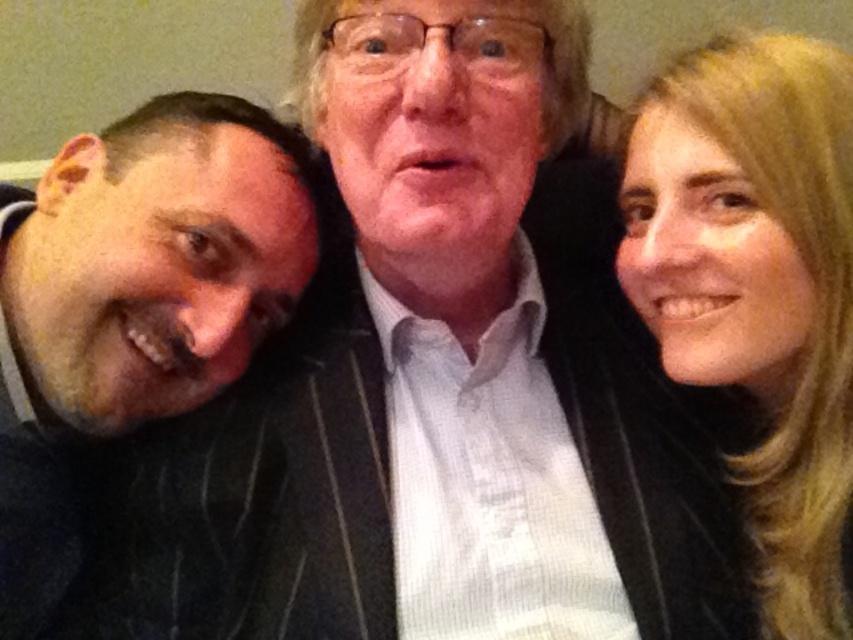
You are standing in front of the group photo and want to touch the dark pinstripe suit at left and the blonde hair at upper right. Which one would you need to reach further to touch?

The dark pinstripe suit at left is closer to you than the blonde hair at upper right, so you would need to reach further to touch the blonde hair at upper right.

You are taking a photo of three people standing in front of a plain wall. The people are wearing a dark pinstripe suit at left and have blonde hair at upper right. Based on their positions, which object is higher up in the image?

The blonde hair at upper right is higher up in the image because the dark pinstripe suit at left is below it.

You are a photographer adjusting the lighting for a group photo. You notice the dark pinstripe suit at left and the blonde hair at upper right in your frame. Which object should you adjust the lighting to highlight more, considering their sizes?

The dark pinstripe suit at left is larger in size than the blonde hair at upper right, so you should adjust the lighting to highlight the dark pinstripe suit at left more because it occupies a bigger area in the frame.